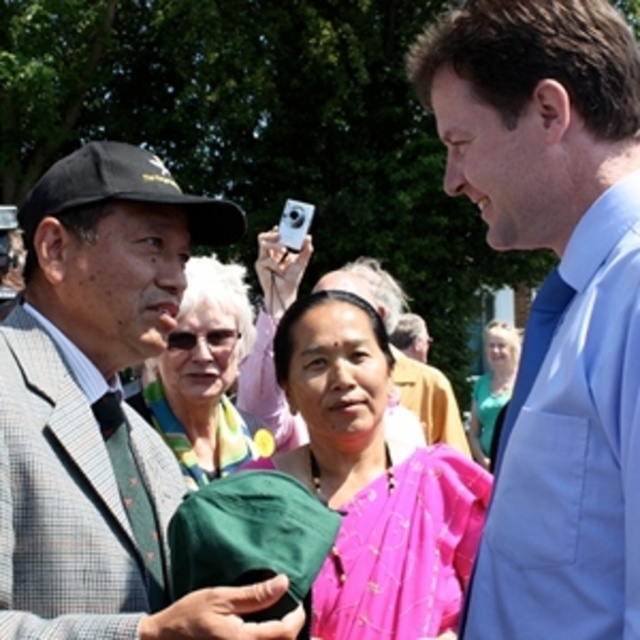
Question: Is blue satin tie at right smaller than pink silk saree at center?

Choices:
 (A) yes
 (B) no

Answer: (A)

Question: Where is matte green scarf at center located in relation to teal fabric dress at center in the image?

Choices:
 (A) left
 (B) right

Answer: (A)

Question: Which point appears farthest from the camera in this image?

Choices:
 (A) (221, 371)
 (B) (518, 624)
 (C) (509, 388)

Answer: (C)

Question: Can you confirm if matte green scarf at center is bigger than teal fabric dress at center?

Choices:
 (A) no
 (B) yes

Answer: (B)

Question: Which point is farther to the camera?

Choices:
 (A) (582, 19)
 (B) (225, 316)
 (C) (28, 525)
 (D) (512, 332)

Answer: (D)

Question: Which object is the closest to the teal fabric dress at center?

Choices:
 (A) green fabric cap at left
 (B) matte green scarf at center

Answer: (B)